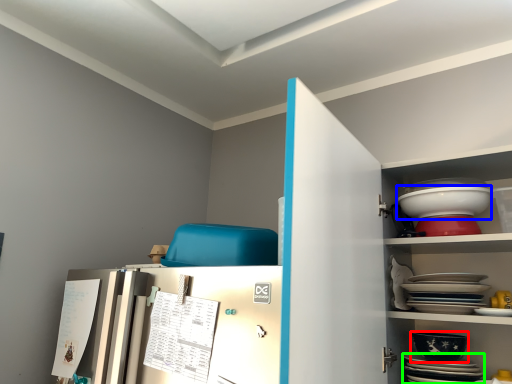
Question: Which object is the closest to the bowl (highlighted by a red box)? Choose among these: bowl (highlighted by a blue box) or platter (highlighted by a green box).

Choices:
 (A) bowl
 (B) platter

Answer: (B)